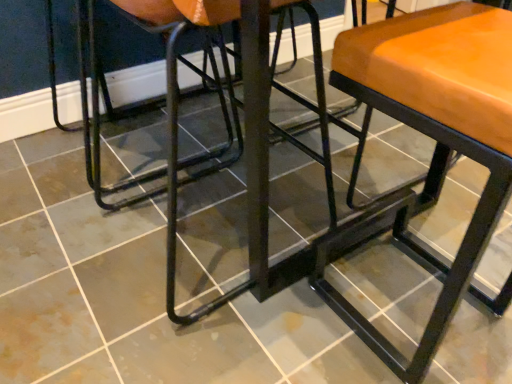
At what (x,y) coordinates should I click in order to perform the action: click on free spot in front of black metal swivel chair at left. Please return your answer as a coordinate pair (x, y). This screenshot has height=384, width=512. Looking at the image, I should click on (66, 234).